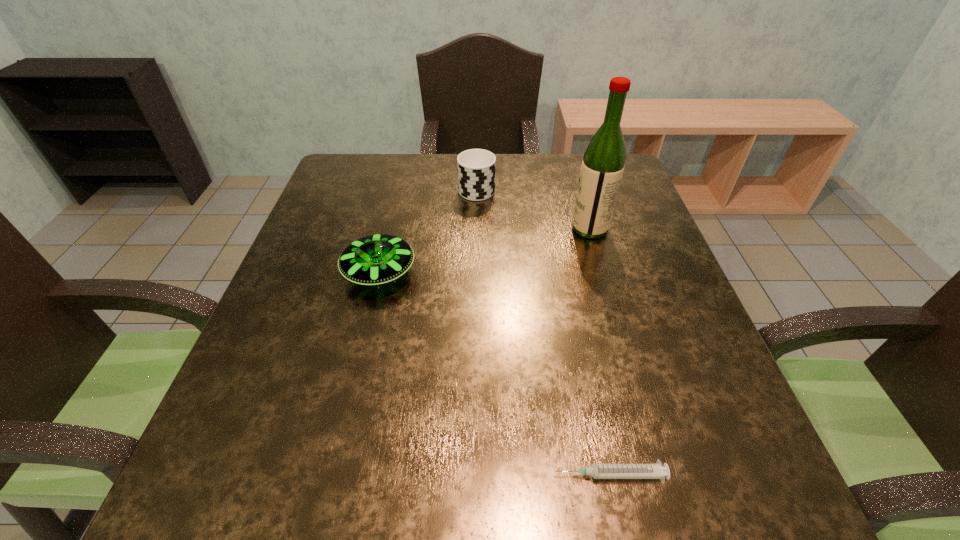
Image resolution: width=960 pixels, height=540 pixels. What are the coordinates of `object that stands as the closest to the cup` in the screenshot? It's located at pos(603,164).

Identify the location of free space that satisfies the following two spatial constraints: 1. on the label of the liquor; 2. on the front side of the leftmost object. The width and height of the screenshot is (960, 540). (603, 272).